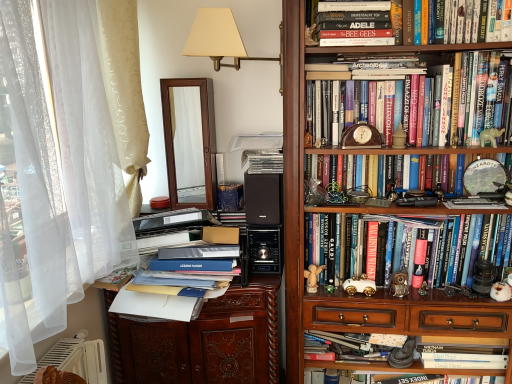
Question: Can we say hardcover book at center, the 2th book from the bottom, lies outside beige fabric lampshade at upper center?

Choices:
 (A) no
 (B) yes

Answer: (B)

Question: Does hardcover book at center, the 2th book from the bottom, have a lesser width compared to beige fabric lampshade at upper center?

Choices:
 (A) yes
 (B) no

Answer: (A)

Question: Is hardcover book at center, the 2th book from the bottom, shorter than beige fabric lampshade at upper center?

Choices:
 (A) yes
 (B) no

Answer: (A)

Question: Is the position of hardcover book at center, which is the fifth book from top to bottom, less distant than that of beige fabric lampshade at upper center?

Choices:
 (A) yes
 (B) no

Answer: (B)

Question: From a real-world perspective, is hardcover book at center, the 2th book from the bottom, positioned over beige fabric lampshade at upper center based on gravity?

Choices:
 (A) no
 (B) yes

Answer: (A)

Question: Considering the relative sizes of hardcover book at center, the 2th book from the bottom, and beige fabric lampshade at upper center in the image provided, is hardcover book at center, the 2th book from the bottom, bigger than beige fabric lampshade at upper center?

Choices:
 (A) no
 (B) yes

Answer: (B)

Question: From the image's perspective, is silver metallic cd case at center, which is the 3th book from bottom to top, located above wooden-framed mirror at center?

Choices:
 (A) no
 (B) yes

Answer: (A)

Question: Is silver metallic cd case at center, which is the 3th book from bottom to top, with wooden-framed mirror at center?

Choices:
 (A) no
 (B) yes

Answer: (A)

Question: Considering the relative positions of silver metallic cd case at center, which is the 3th book from bottom to top, and wooden-framed mirror at center in the image provided, is silver metallic cd case at center, which is the 3th book from bottom to top, in front of wooden-framed mirror at center?

Choices:
 (A) no
 (B) yes

Answer: (B)

Question: Is silver metallic cd case at center, marked as the 4th book in a top-to-bottom arrangement, to the left of wooden-framed mirror at center from the viewer's perspective?

Choices:
 (A) yes
 (B) no

Answer: (B)

Question: Considering the relative positions of silver metallic cd case at center, which is the 3th book from bottom to top, and wooden-framed mirror at center in the image provided, is silver metallic cd case at center, which is the 3th book from bottom to top, behind wooden-framed mirror at center?

Choices:
 (A) yes
 (B) no

Answer: (B)

Question: Can you confirm if silver metallic cd case at center, which is the 3th book from bottom to top, is smaller than wooden-framed mirror at center?

Choices:
 (A) no
 (B) yes

Answer: (B)

Question: Can you confirm if wooden bookshelf at upper right is wider than beige fabric lampshade at upper center?

Choices:
 (A) no
 (B) yes

Answer: (B)